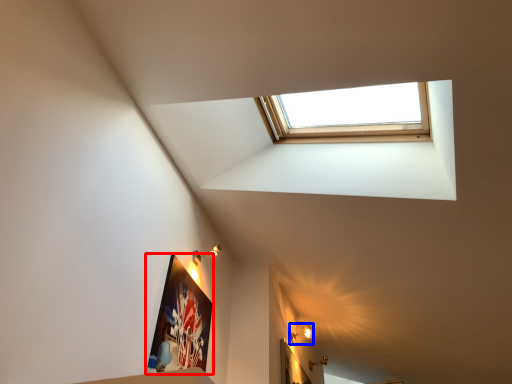
Question: Which object appears closest to the camera in this image, picture frame (highlighted by a red box) or light fixture (highlighted by a blue box)?

Choices:
 (A) picture frame
 (B) light fixture

Answer: (A)